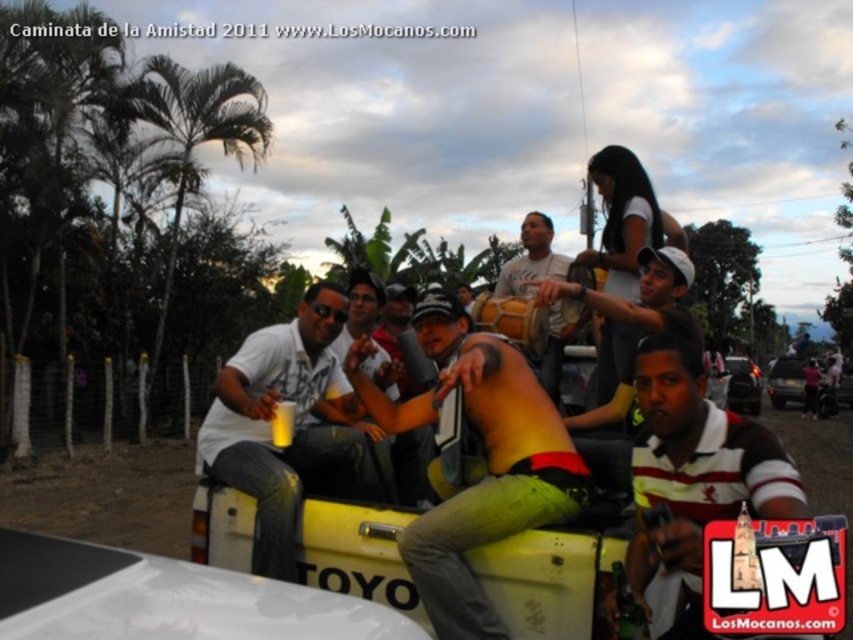
You are standing 10 feet away from the point at coordinates point (664, 296). Can you reach it without moving closer?

The distance of point (664, 296) from viewer is 9.08 feet, so yes, you can reach it without moving closer since you are already 10 feet away, which is slightly farther than the point.

Based on the scene description, where is the yellow matte truck at center located in relation to the point at coordinates (476,461)?

The point at coordinates (476,461) corresponds to the yellow matte truck at center, meaning it is located exactly at that position.

You are a photographer trying to capture both the yellow matte truck at center and the black glossy car at right in a single frame. Given their sizes, which vehicle should you position closer to the camera to ensure both fit in the photo?

Since the yellow matte truck at center is thinner than the black glossy car at right, you should position the black glossy car at right closer to the camera to ensure both vehicles fit in the photo.